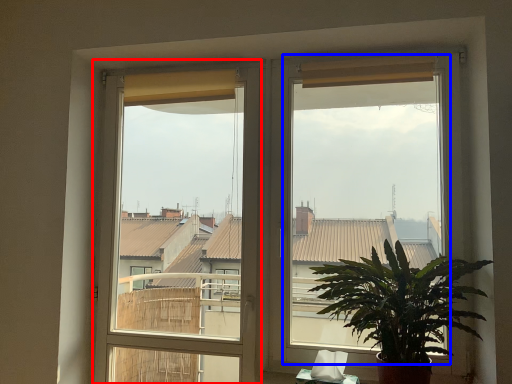
Question: Among these objects, which one is nearest to the camera, window frame (highlighted by a red box) or window screen (highlighted by a blue box)?

Choices:
 (A) window frame
 (B) window screen

Answer: (B)